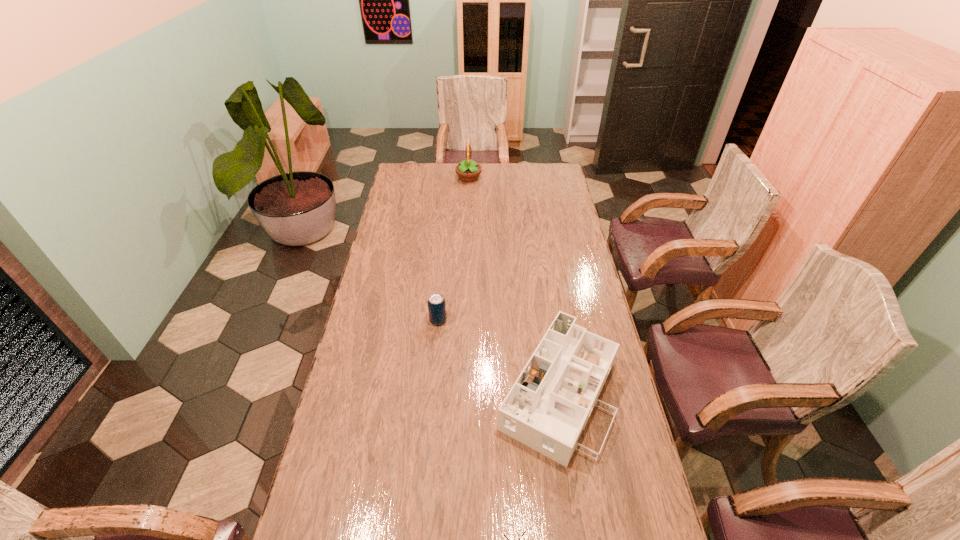
Identify the location of the tallest object. (468, 170).

Where is `sunflower`? The width and height of the screenshot is (960, 540). sunflower is located at coordinates (468, 170).

Find the location of a particular element. This screenshot has height=540, width=960. the third nearest object is located at coordinates (436, 303).

The width and height of the screenshot is (960, 540). In order to click on dollhouse in this screenshot , I will do `click(547, 408)`.

At what (x,y) coordinates should I click in order to perform the action: click on vacant area located on the face of the farthest object. Please return your answer as a coordinate pair (x, y). The image size is (960, 540). Looking at the image, I should click on (520, 178).

Where is `vacant area located on the right of the second farthest object`? The image size is (960, 540). vacant area located on the right of the second farthest object is located at coordinates (482, 320).

Locate an element on the screen. The width and height of the screenshot is (960, 540). free space located on the front of the dollhouse is located at coordinates (578, 530).

I want to click on object positioned at the far edge, so click(x=468, y=170).

Identify the location of object situated at the right edge. (547, 408).

Where is `vacant space at the far edge`? vacant space at the far edge is located at coordinates (480, 173).